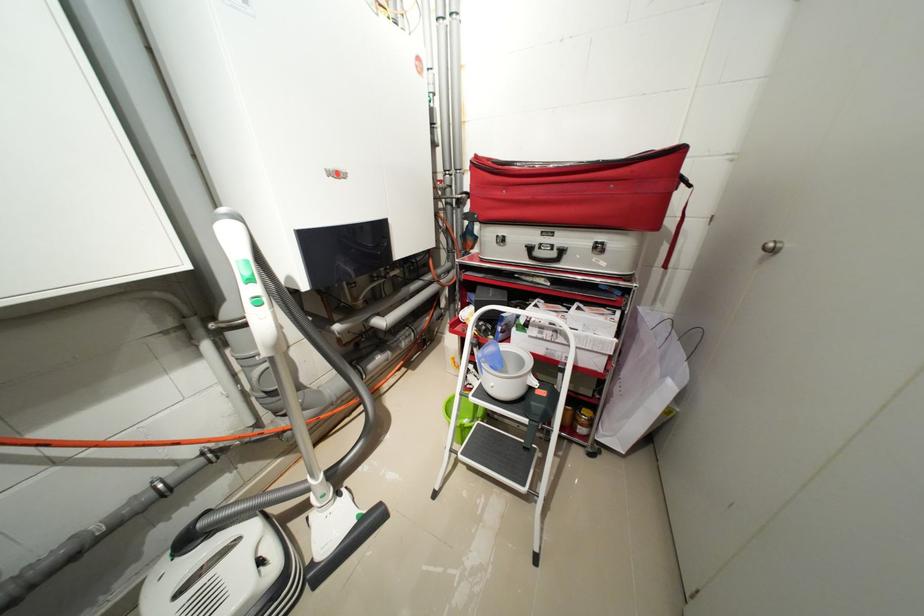
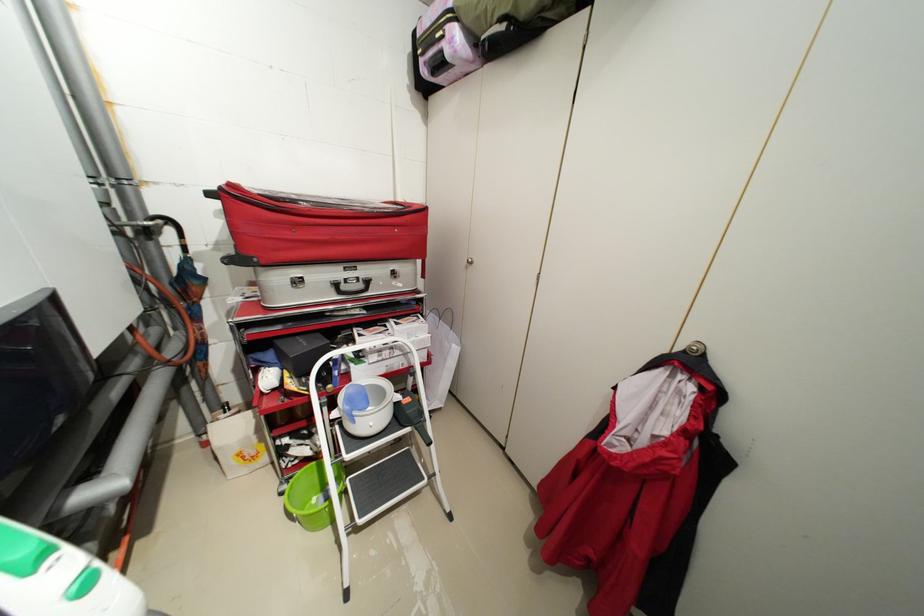
Question: How did the camera likely rotate?

Choices:
 (A) Left
 (B) Right
 (C) Up
 (D) Down

Answer: (B)